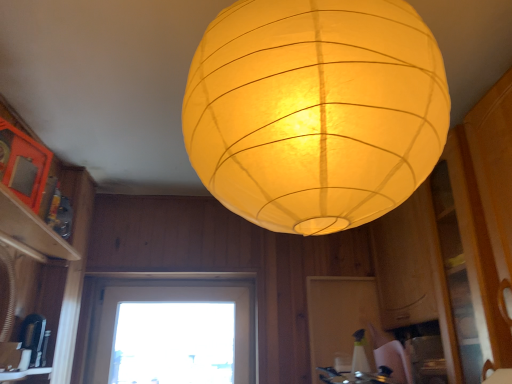
Question: Does transparent glass window at center appear on the right side of matte wood shelf at upper left?

Choices:
 (A) yes
 (B) no

Answer: (A)

Question: Is transparent glass window at center behind matte wood shelf at upper left?

Choices:
 (A) no
 (B) yes

Answer: (B)

Question: From the image's perspective, is transparent glass window at center located above matte wood shelf at upper left?

Choices:
 (A) yes
 (B) no

Answer: (B)

Question: Is transparent glass window at center taller than matte wood shelf at upper left?

Choices:
 (A) no
 (B) yes

Answer: (B)

Question: Does transparent glass window at center turn towards matte wood shelf at upper left?

Choices:
 (A) yes
 (B) no

Answer: (A)

Question: Is transparent glass window at center outside matte wood shelf at upper left?

Choices:
 (A) yes
 (B) no

Answer: (A)

Question: From the image's perspective, is transparent glass window at center under black plastic coffee maker at lower left?

Choices:
 (A) no
 (B) yes

Answer: (B)

Question: Is transparent glass window at center at the right side of black plastic coffee maker at lower left?

Choices:
 (A) no
 (B) yes

Answer: (B)

Question: From a real-world perspective, is transparent glass window at center beneath black plastic coffee maker at lower left?

Choices:
 (A) no
 (B) yes

Answer: (A)

Question: Can black plastic coffee maker at lower left be found inside transparent glass window at center?

Choices:
 (A) no
 (B) yes

Answer: (A)

Question: Is transparent glass window at center looking in the opposite direction of black plastic coffee maker at lower left?

Choices:
 (A) yes
 (B) no

Answer: (B)

Question: Can you confirm if transparent glass window at center is bigger than black plastic coffee maker at lower left?

Choices:
 (A) yes
 (B) no

Answer: (A)

Question: Does metallic silver gas stove at lower center have a greater height compared to matte wood shelf at upper left?

Choices:
 (A) no
 (B) yes

Answer: (B)